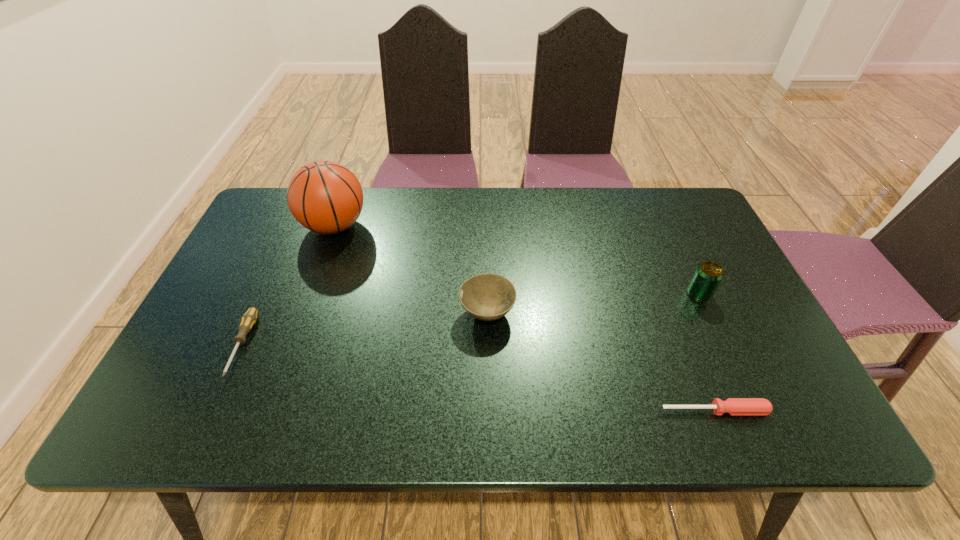
The height and width of the screenshot is (540, 960). Identify the location of vacant area between the basketball and the beer can. (516, 260).

Locate an element on the screen. The height and width of the screenshot is (540, 960). vacant area between the bowl and the farther screwdriver is located at coordinates (365, 329).

Locate an element on the screen. vacant point located between the second tallest object and the left screwdriver is located at coordinates (470, 319).

Find the location of `blank region between the right screwdriver and the beer can`. blank region between the right screwdriver and the beer can is located at coordinates (707, 352).

Image resolution: width=960 pixels, height=540 pixels. Identify the location of vacant region between the third tallest object and the second tallest object. (593, 304).

In order to click on object identified as the second closest to the farther screwdriver in this screenshot , I will do `click(488, 297)`.

This screenshot has width=960, height=540. In order to click on object identified as the second closest to the third shortest object in this screenshot , I will do `click(733, 406)`.

Locate an element on the screen. The width and height of the screenshot is (960, 540). free location that satisfies the following two spatial constraints: 1. on the back side of the beer can; 2. on the right side of the right screwdriver is located at coordinates (668, 294).

Find the location of a particular element. The image size is (960, 540). free space that satisfies the following two spatial constraints: 1. on the front side of the nearer screwdriver; 2. on the right side of the third shortest object is located at coordinates (489, 410).

I want to click on free space in the image that satisfies the following two spatial constraints: 1. at the tip of the farther screwdriver; 2. on the right side of the right screwdriver, so coord(212,410).